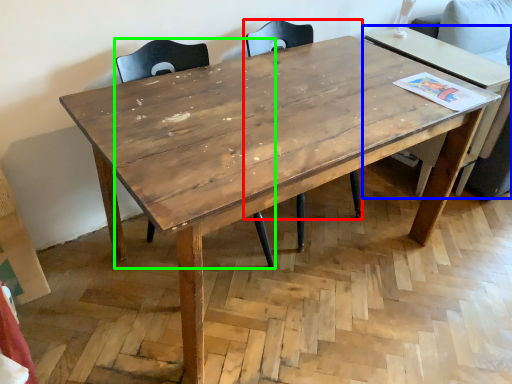
Question: Which object is the closest to the chair (highlighted by a red box)? Choose among these: table (highlighted by a blue box) or chair (highlighted by a green box).

Choices:
 (A) table
 (B) chair

Answer: (B)